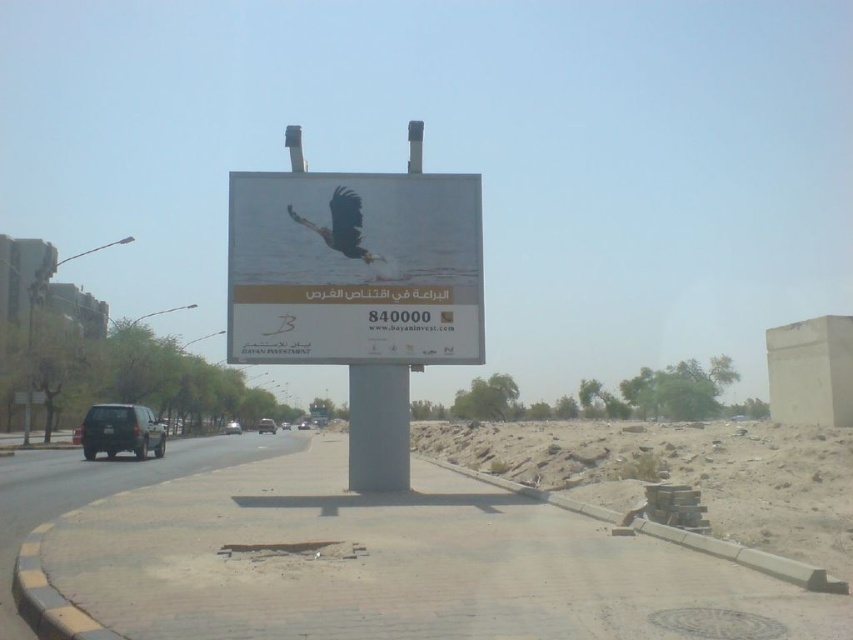
Question: Where is dark brown feathers at center located in relation to silver metallic suv at center in the image?

Choices:
 (A) right
 (B) left

Answer: (A)

Question: Which point appears farthest from the camera in this image?

Choices:
 (A) (305, 420)
 (B) (236, 422)
 (C) (424, 221)
 (D) (285, 428)

Answer: (A)

Question: Which point appears farthest from the camera in this image?

Choices:
 (A) (405, 410)
 (B) (264, 420)
 (C) (289, 428)
 (D) (344, 225)

Answer: (C)

Question: Which object is the farthest from the silver metallic car at center?

Choices:
 (A) metallic billboard at center
 (B) metallic silver suv at center
 (C) silver metallic suv at center

Answer: (A)

Question: Is metallic billboard at center wider than matte black suv at lower left?

Choices:
 (A) no
 (B) yes

Answer: (B)

Question: Is matte black suv at lower left positioned before dark brown feathers at center?

Choices:
 (A) yes
 (B) no

Answer: (B)